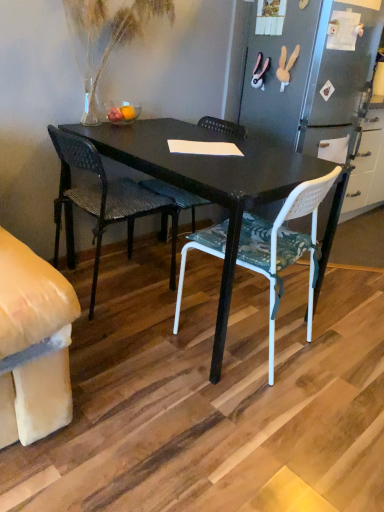
Question: From a real-world perspective, is woven dark brown chair at center, which is the second chair in right-to-left order, positioned above or below white plastic chair at center, the 2th chair in the left-to-right sequence?

Choices:
 (A) below
 (B) above

Answer: (A)

Question: Looking at the image, does woven dark brown chair at center, which ranks as the 1th chair in left-to-right order, seem bigger or smaller compared to white plastic chair at center, placed as the 1th chair when sorted from right to left?

Choices:
 (A) small
 (B) big

Answer: (A)

Question: Estimate the real-world distances between objects in this image. Which object is farther from the white plastic chair at center, the 2th chair in the left-to-right sequence?

Choices:
 (A) translucent glass vase at upper left
 (B) woven dark brown chair at center, which is the second chair in right-to-left order

Answer: (A)

Question: Based on their relative distances, which object is farther from the white plastic chair at center, the 2th chair in the left-to-right sequence?

Choices:
 (A) translucent glass vase at upper left
 (B) woven dark brown chair at center, which is the second chair in right-to-left order

Answer: (A)